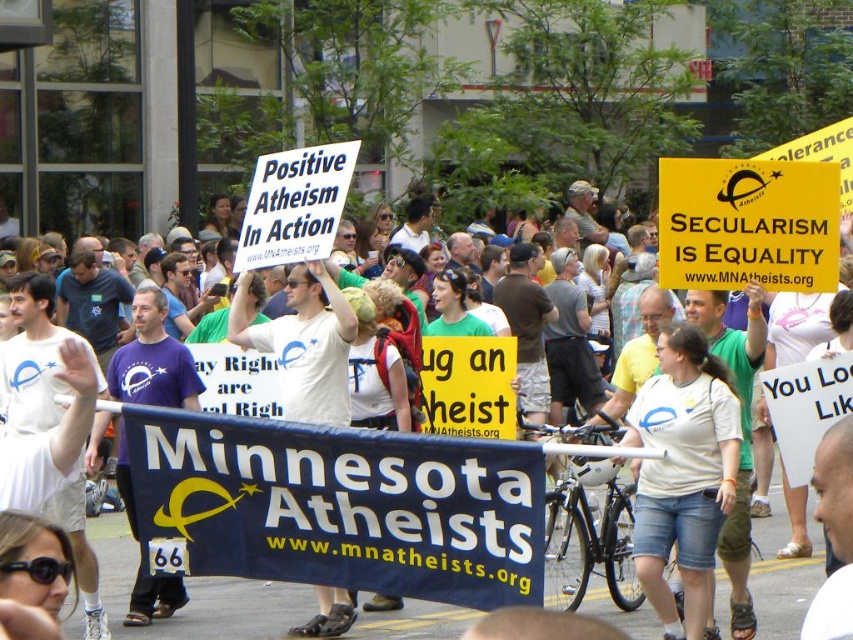
You are a photographer at the event and want to capture both the yellow paper sign at center and the white paper sign at upper center in a single shot. Which sign should you focus on to ensure both are visible without moving the camera?

The yellow paper sign at center is positioned over the white paper sign at upper center, so focusing on the yellow paper sign at center will ensure both are visible in the frame without needing to adjust the camera position.

You are a photographer at the event and want to capture both the yellow paper sign at center and the white paper sign at upper center in a single frame. Which sign should you focus on to ensure both are visible without zooming in or out?

The yellow paper sign at center is larger in size than the white paper sign at upper center, so focusing on the yellow paper sign at center would allow both signs to be visible in the frame without needing to adjust the zoom.